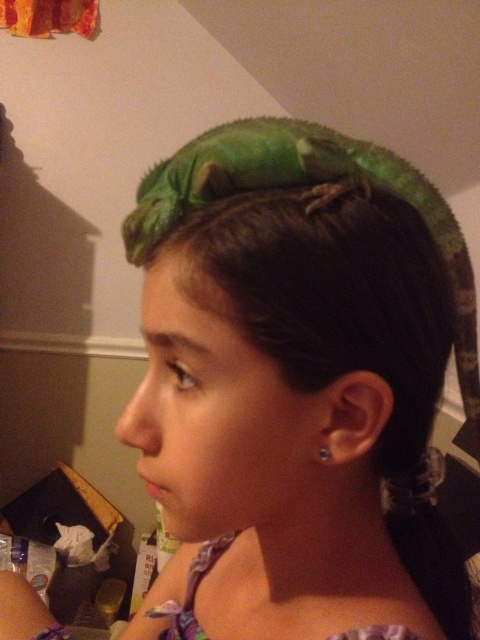
You are a photographer trying to capture a clear photo of both the green scaly lizard at upper center and the clear plastic earring at ear. Given that your camera can only focus on objects within 5 inches of each other, will you be able to take a photo that includes both subjects clearly?

The green scaly lizard at upper center and the clear plastic earring at ear are 6.36 inches apart from each other. Since the camera requires objects to be within 5 inches for clear focus, the distance between them exceeds the camera limit. Therefore, you cannot take a photo that includes both subjects clearly.

You are a photographer trying to capture the green scaly lizard at upper center in the image. You notice a point at coordinates (x=314, y=198). Is this point located on the green scaly lizard at upper center?

Yes, the point at coordinates (x=314, y=198) is located on the green scaly lizard at upper center, as stated in the description.